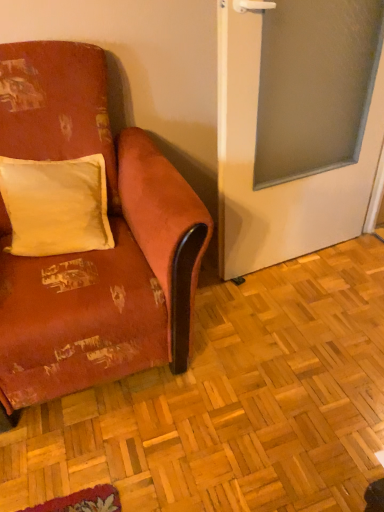
Find the location of a particular element. The image size is (384, 512). empty space that is to the right of velvet-like orange couch at left is located at coordinates (290, 352).